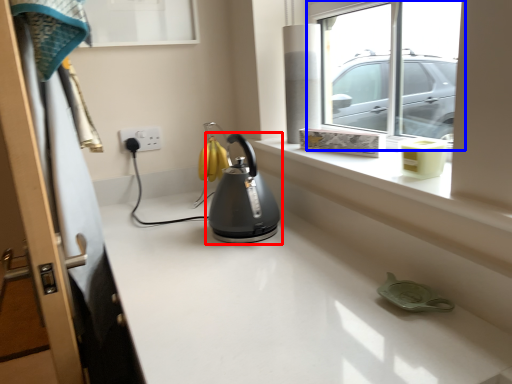
Question: Among these objects, which one is nearest to the camera, kettle (highlighted by a red box) or window (highlighted by a blue box)?

Choices:
 (A) kettle
 (B) window

Answer: (B)